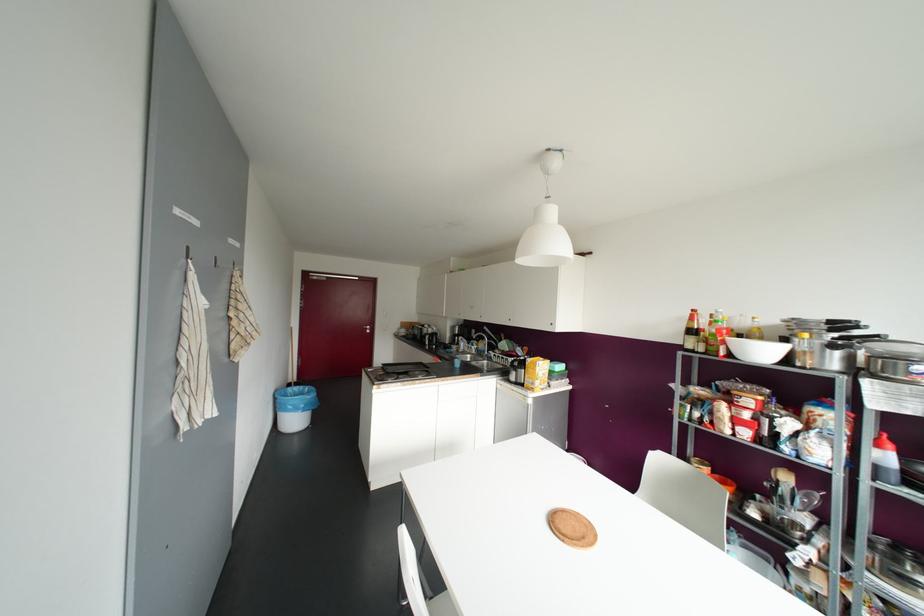
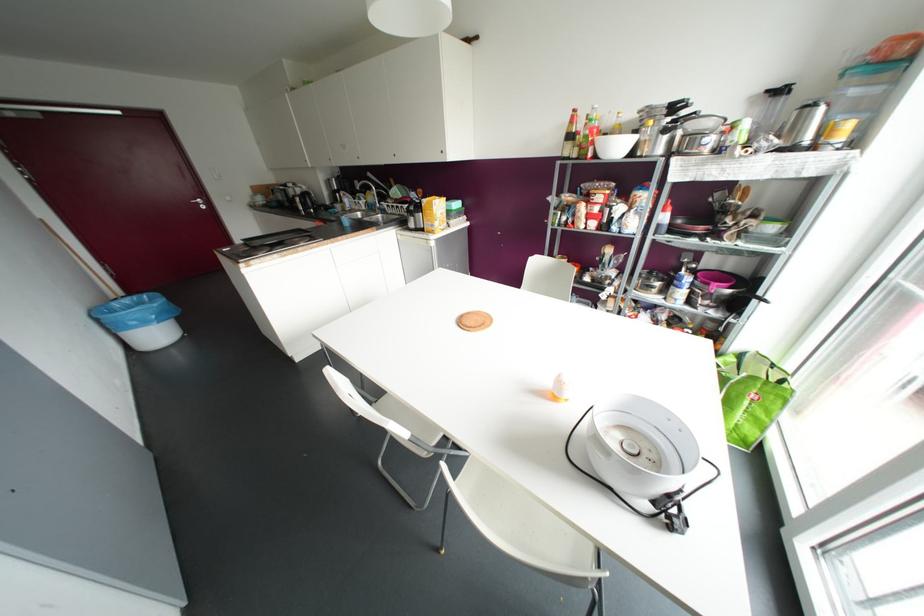
Find the pixel in the second image that matches the point at 297,387 in the first image.

(127, 300)